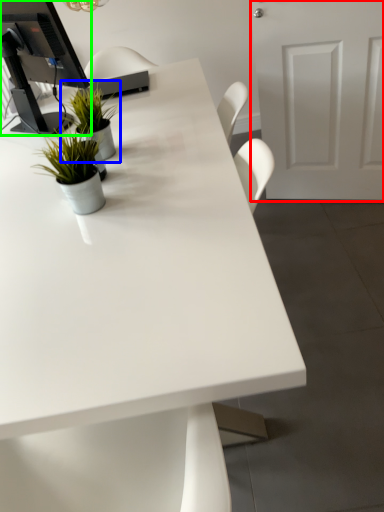
Question: Which is nearer to the door (highlighted by a red box)? houseplant (highlighted by a blue box) or desktop computer (highlighted by a green box).

Choices:
 (A) houseplant
 (B) desktop computer

Answer: (A)